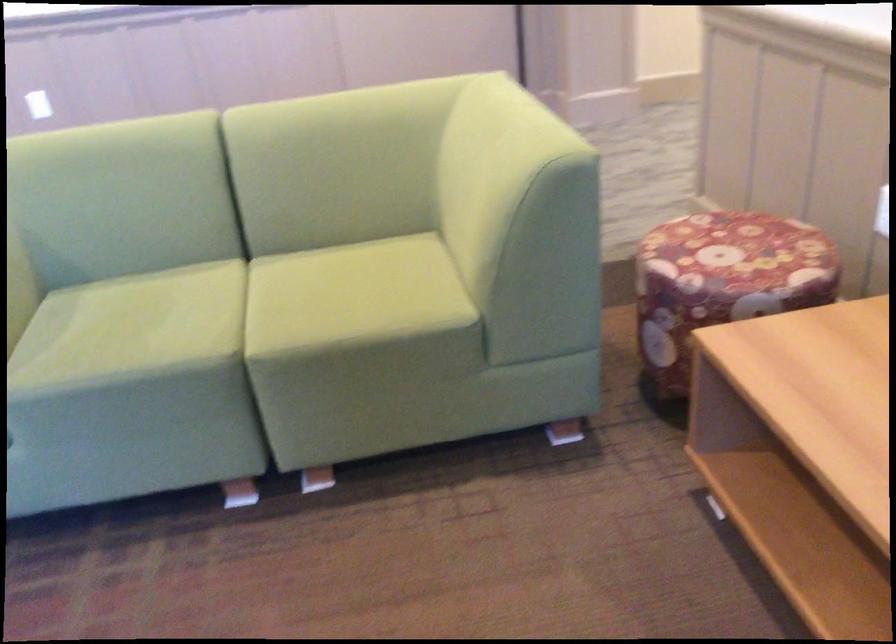
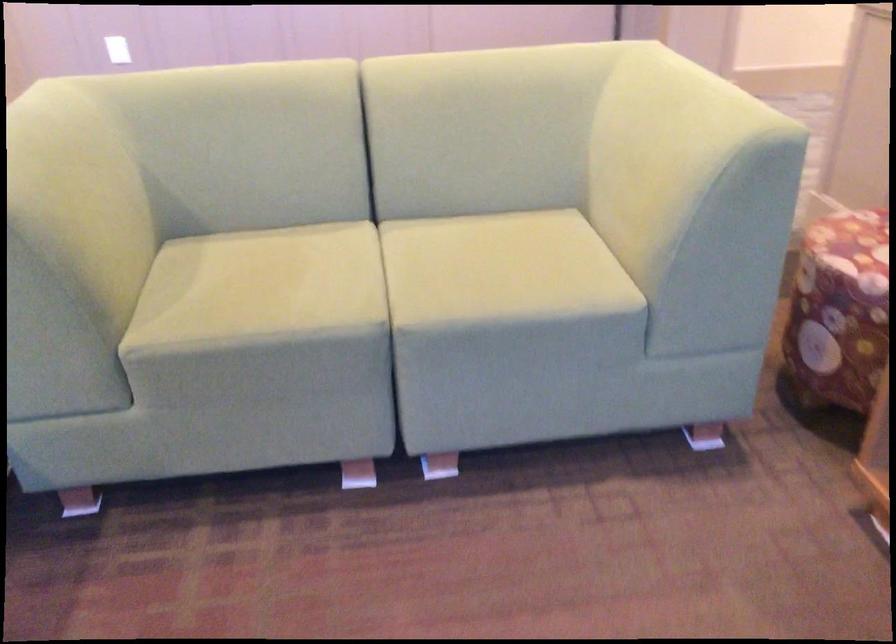
What movement of the cameraman would produce the second image?

The cameraman walked toward left, forward.